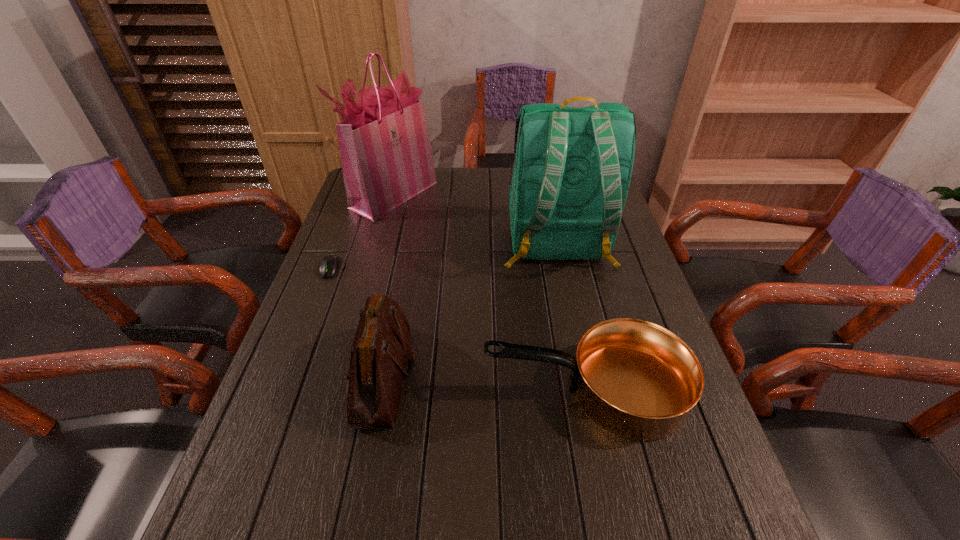
I want to click on shopping bag, so click(385, 149).

In order to click on backpack in this screenshot , I will do `click(569, 181)`.

Find the location of `shoulder bag`. shoulder bag is located at coordinates (381, 350).

Identify the location of frying pan. The width and height of the screenshot is (960, 540). (635, 379).

You are a GUI agent. You are given a task and a screenshot of the screen. Output one action in this format:
    pyautogui.click(x=<x>, y=<y>)
    Task: Click on the computer mouse
    The height and width of the screenshot is (540, 960).
    Given the screenshot: What is the action you would take?
    pyautogui.click(x=330, y=264)

What are the coordinates of `vacant space situated on the front of the shopping bag` in the screenshot? It's located at (384, 231).

This screenshot has height=540, width=960. I want to click on vacant space located 0.120m on the back of the backpack, so click(x=572, y=318).

I want to click on vacant area situated 0.210m on the back of the shoulder bag, so click(x=404, y=272).

Image resolution: width=960 pixels, height=540 pixels. What are the coordinates of `free space located 0.230m on the handle side of the frying pan` in the screenshot? It's located at [x=379, y=390].

Image resolution: width=960 pixels, height=540 pixels. What are the coordinates of `vacant region located on the handle side of the frying pan` in the screenshot? It's located at (x=374, y=390).